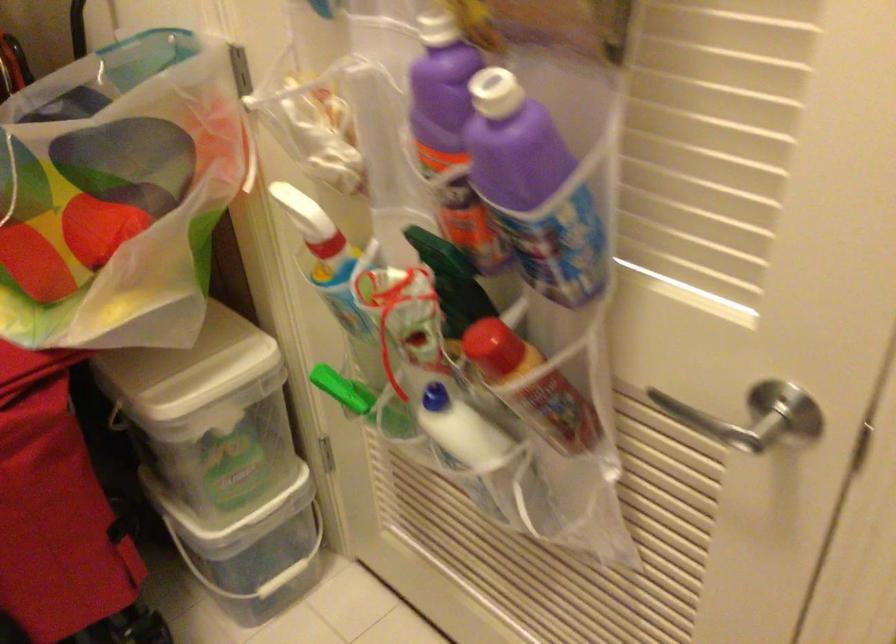
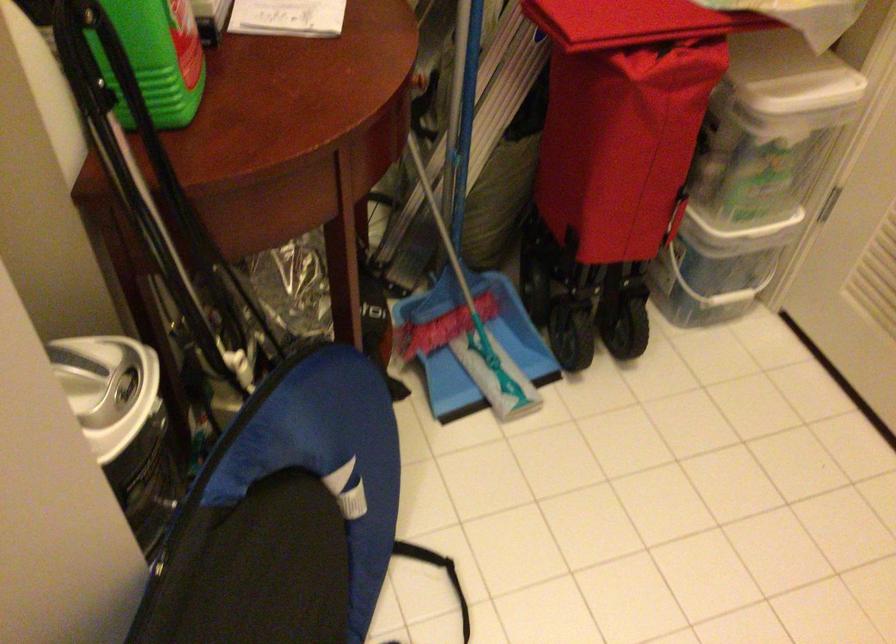
Locate, in the second image, the point that corresponds to (217,468) in the first image.

(752, 174)